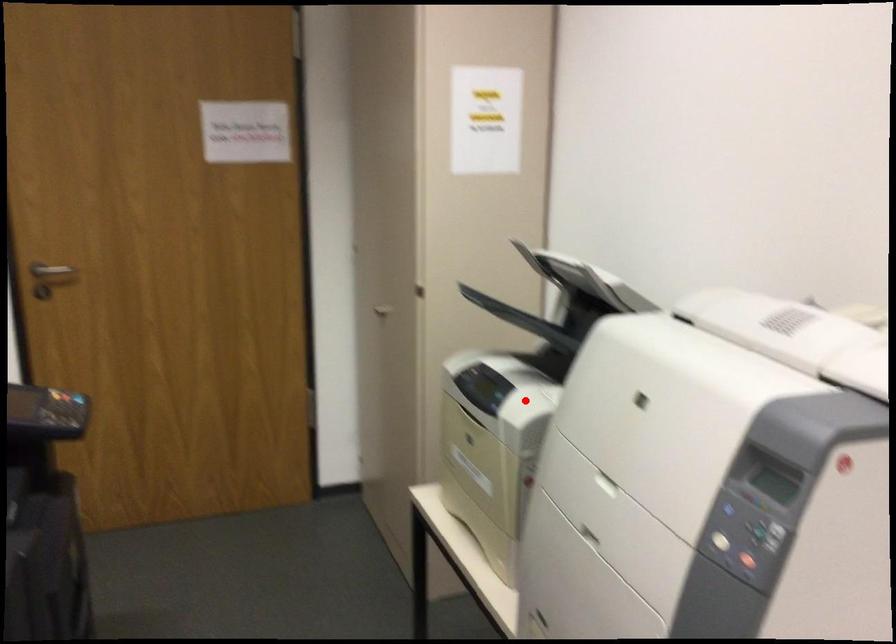
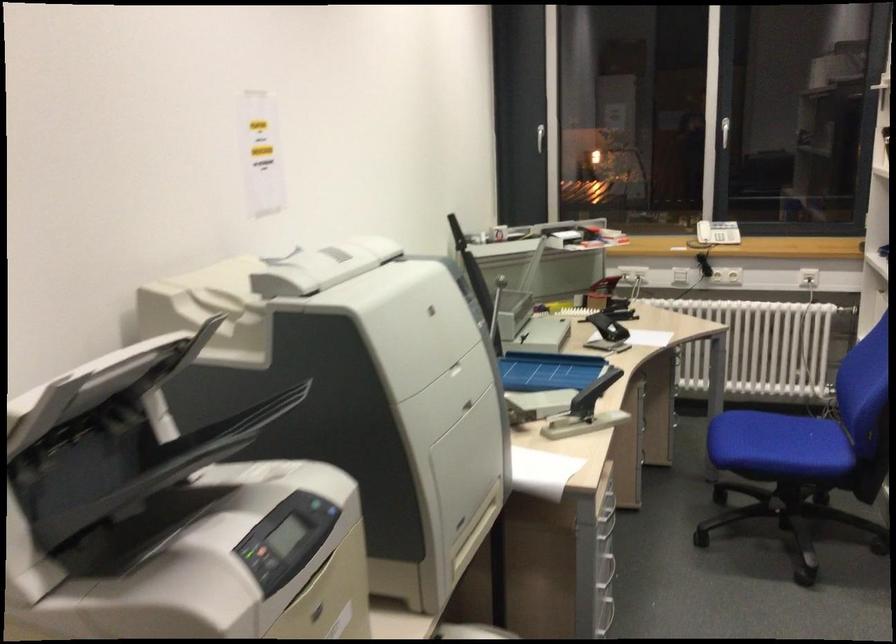
Question: A red point is marked in image1. In image2, is the corresponding 3D point closer to the camera or farther? Reply with the corresponding letter.

Choices:
 (A) The corresponding 3D point is closer.
 (B) The corresponding 3D point is farther.

Answer: (A)